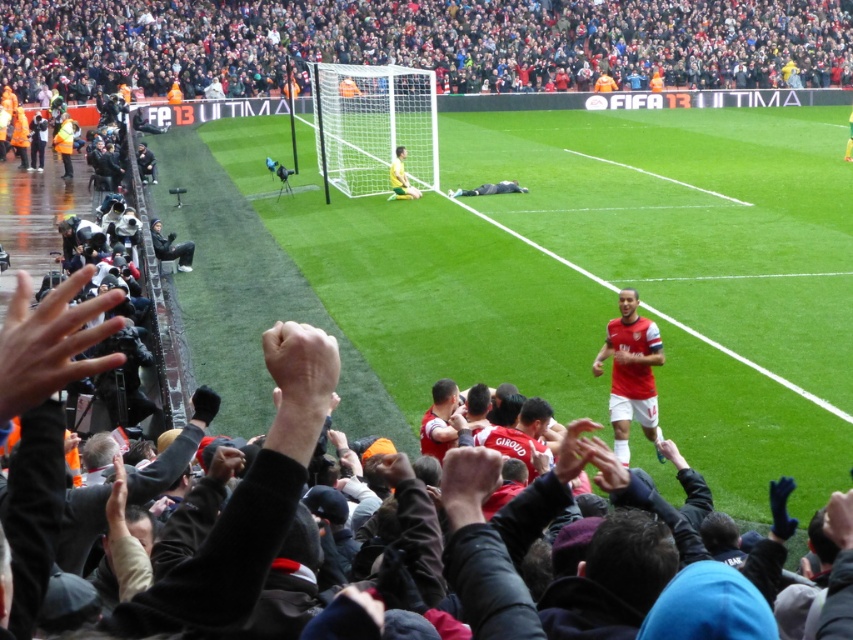
Question: Is red matte jersey at center below matte red jersey at center?

Choices:
 (A) no
 (B) yes

Answer: (A)

Question: Which object appears closest to the camera in this image?

Choices:
 (A) black leather jacket at left
 (B) green grass football field at center

Answer: (B)

Question: Among these objects, which one is nearest to the camera?

Choices:
 (A) green grass football field at center
 (B) red fabric crowd at upper center

Answer: (A)

Question: Which is nearer to the black leather jacket at left?

Choices:
 (A) red fabric crowd at upper center
 (B) matte red jersey at center
 (C) red matte jersey at center
 (D) green grass football field at center

Answer: (D)

Question: Does red matte jersey at center have a smaller size compared to black leather jacket at left?

Choices:
 (A) yes
 (B) no

Answer: (A)

Question: Is red matte jersey at center to the left of black leather jacket at left from the viewer's perspective?

Choices:
 (A) yes
 (B) no

Answer: (B)